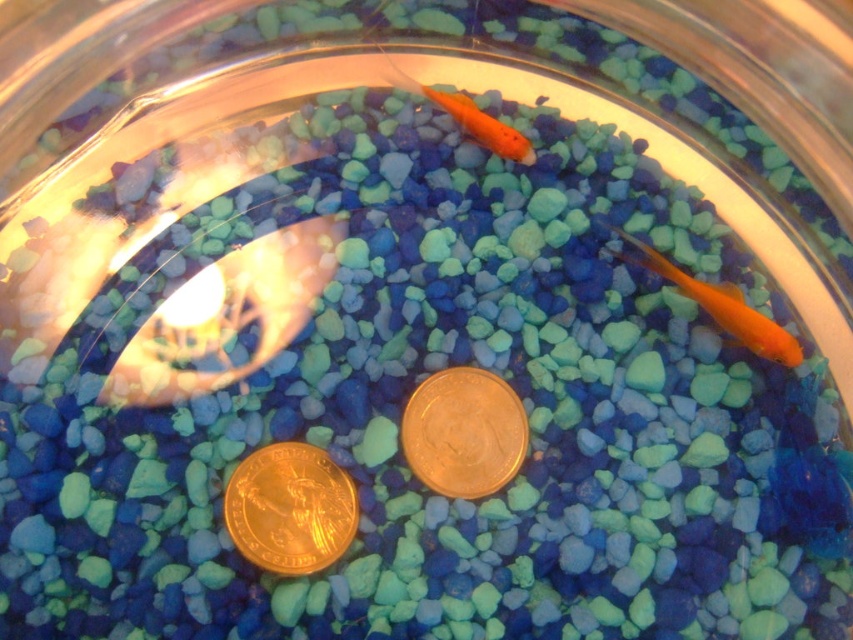
Does gold plated coin at center have a greater width compared to shiny orange fish at upper center?

Yes.

Does gold plated coin at center appear on the left side of shiny orange fish at upper center?

Correct, you'll find gold plated coin at center to the left of shiny orange fish at upper center.

Is point (309, 522) positioned after point (469, 109)?

No, (309, 522) is in front of (469, 109).

At what (x,y) coordinates should I click in order to perform the action: click on gold plated coin at center. Please return your answer as a coordinate pair (x, y). This screenshot has width=853, height=640. Looking at the image, I should click on (289, 508).

Is matte orange goldfish at upper center smaller than shiny orange fish at upper center?

No.

Between point (492, 134) and point (459, 116), which one is positioned in front?

Point (492, 134)

This screenshot has height=640, width=853. What do you see at coordinates (465, 115) in the screenshot? I see `matte orange goldfish at upper center` at bounding box center [465, 115].

I want to click on matte orange goldfish at upper center, so click(465, 115).

Which is more to the right, gold plated coin at center or gold metallic coin at center?

gold metallic coin at center is more to the right.

In the scene shown: Is gold plated coin at center further to camera compared to gold metallic coin at center?

No, gold plated coin at center is closer to the viewer.

Does point (326, 493) come in front of point (424, 400)?

Yes, point (326, 493) is in front of point (424, 400).

Find the location of a particular element. Image resolution: width=853 pixels, height=640 pixels. gold plated coin at center is located at coordinates (289, 508).